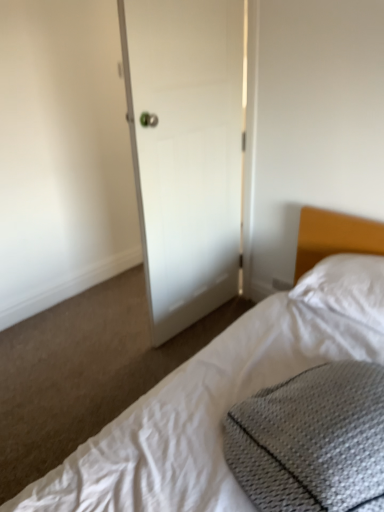
Question: Is white matte door at center next to white textured bed at lower right?

Choices:
 (A) no
 (B) yes

Answer: (A)

Question: Can you confirm if white matte door at center is thinner than white textured bed at lower right?

Choices:
 (A) yes
 (B) no

Answer: (A)

Question: Is white matte door at center oriented towards white textured bed at lower right?

Choices:
 (A) no
 (B) yes

Answer: (A)

Question: Is white matte door at center not inside white textured bed at lower right?

Choices:
 (A) yes
 (B) no

Answer: (A)

Question: Is white textured bed at lower right a part of white matte door at center?

Choices:
 (A) yes
 (B) no

Answer: (B)

Question: In terms of width, does gray textured pillow at lower right look wider or thinner when compared to white matte door at center?

Choices:
 (A) wide
 (B) thin

Answer: (A)

Question: From a real-world perspective, is gray textured pillow at lower right physically located above or below white matte door at center?

Choices:
 (A) above
 (B) below

Answer: (B)

Question: Would you say gray textured pillow at lower right is to the left or to the right of white matte door at center in the picture?

Choices:
 (A) right
 (B) left

Answer: (A)

Question: Considering their positions, is gray textured pillow at lower right located in front of or behind white matte door at center?

Choices:
 (A) front
 (B) behind

Answer: (A)

Question: From a real-world perspective, is gray textured pillow at lower right positioned above or below white textured bed at lower right?

Choices:
 (A) below
 (B) above

Answer: (B)

Question: Is gray textured pillow at lower right taller or shorter than white textured bed at lower right?

Choices:
 (A) short
 (B) tall

Answer: (A)

Question: From the image's perspective, is gray textured pillow at lower right above or below white textured bed at lower right?

Choices:
 (A) below
 (B) above

Answer: (B)

Question: In terms of width, does gray textured pillow at lower right look wider or thinner when compared to white textured bed at lower right?

Choices:
 (A) wide
 (B) thin

Answer: (B)

Question: Considering the positions of white soft pillow at right and white matte door at center in the image, is white soft pillow at right bigger or smaller than white matte door at center?

Choices:
 (A) big
 (B) small

Answer: (B)

Question: In the image, is white soft pillow at right positioned in front of or behind white matte door at center?

Choices:
 (A) behind
 (B) front

Answer: (B)